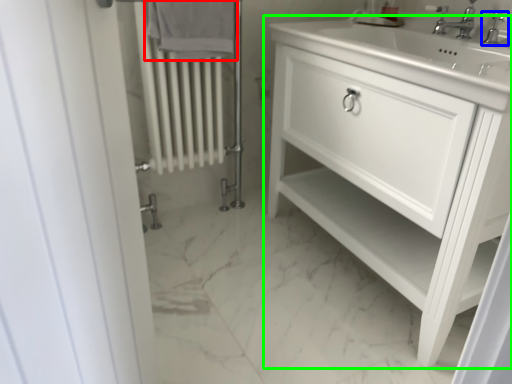
Question: Which is nearer to the bath towel (highlighted by a red box)? tap (highlighted by a blue box) or bathroom cabinet (highlighted by a green box).

Choices:
 (A) tap
 (B) bathroom cabinet

Answer: (B)